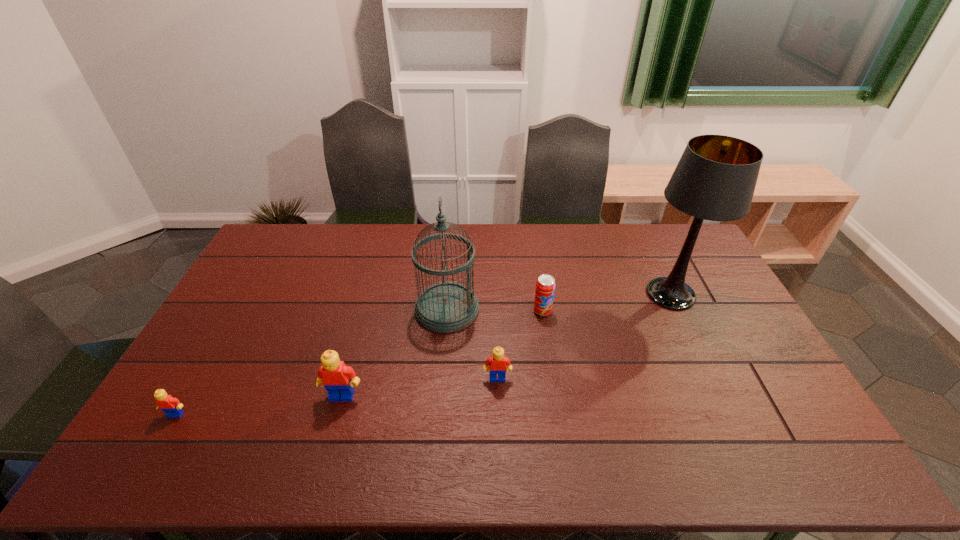
This screenshot has height=540, width=960. Find the location of `vacant space that satisfies the following two spatial constraints: 1. on the front side of the rightmost object; 2. on the front-facing side of the fourth object from right to left`. vacant space that satisfies the following two spatial constraints: 1. on the front side of the rightmost object; 2. on the front-facing side of the fourth object from right to left is located at coordinates (678, 309).